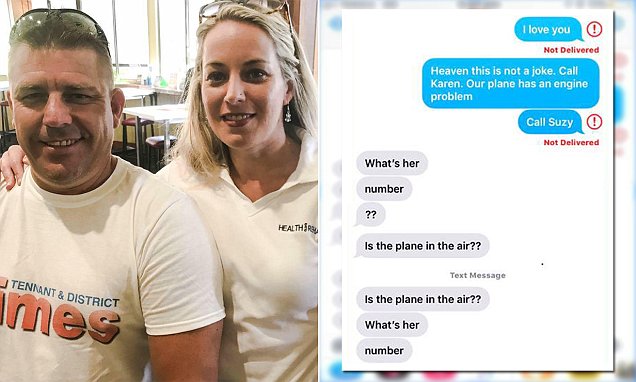
Identify the location of table. (130, 93), (158, 115).